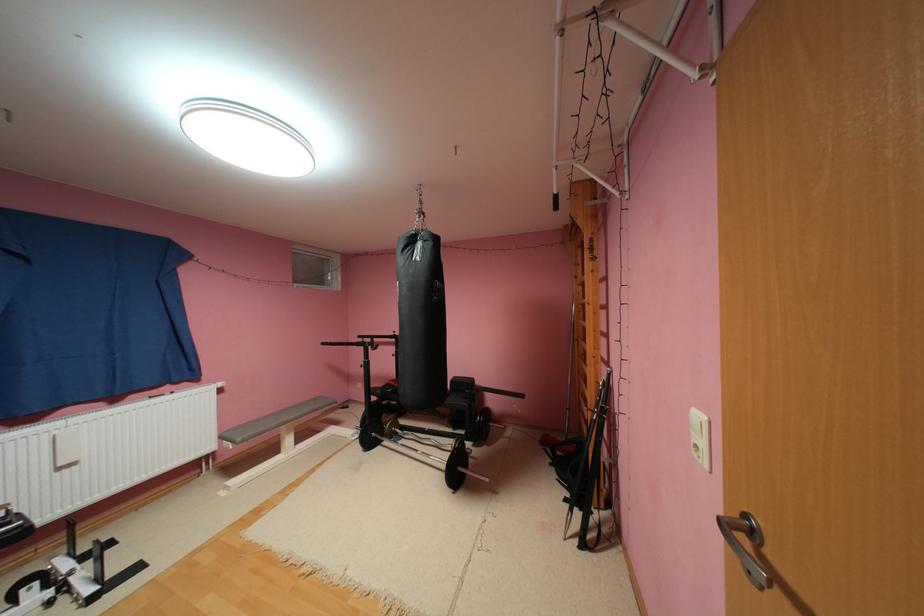
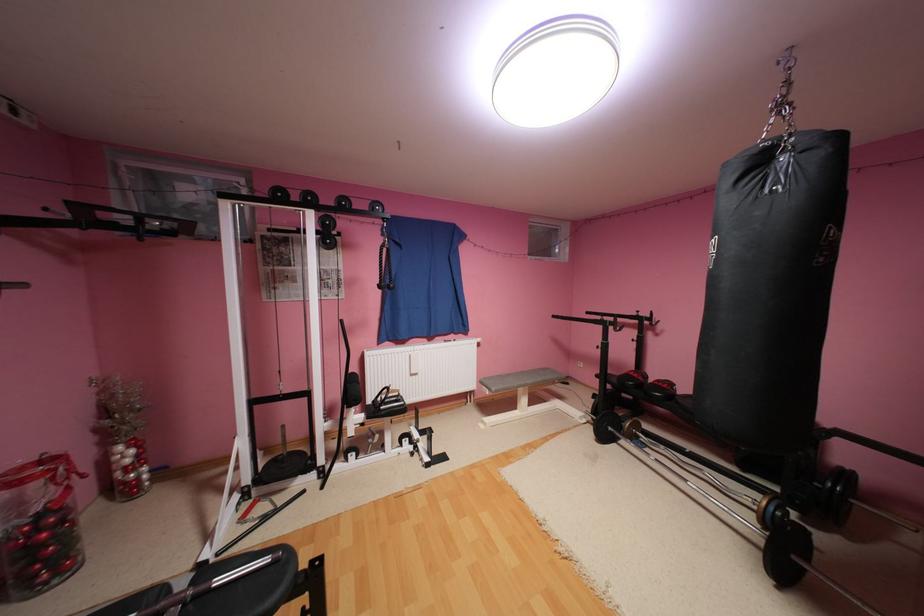
In the second image, find the point that corresponds to [387,392] in the first image.

(624, 379)